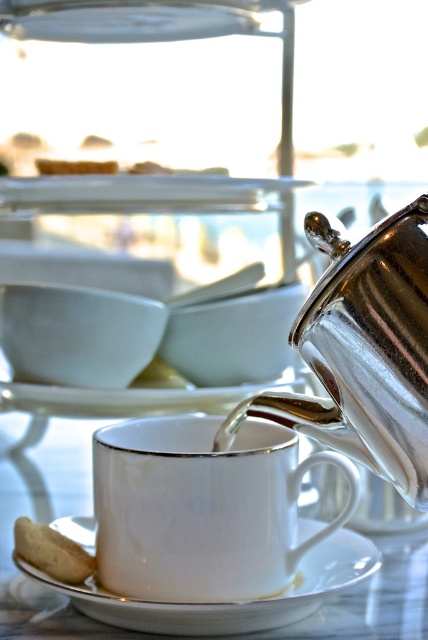
You are a guest at a tea ceremony and want to place a green matte cookie at center on the table without touching the white porcelain cup at center. Is the cookie currently positioned behind or in front of the cup?

The white porcelain cup at center is in front of the green matte cookie at center, so the cookie is positioned behind the cup.

You are looking at the tea setting and want to place a small sugar cube between the two points marked as point (165, 394) and point (15, 531). Which point should the sugar cube be closer to in order to be nearer to the viewer?

The sugar cube should be closer to point (165, 394) because it is further to the viewer than point (15, 531).